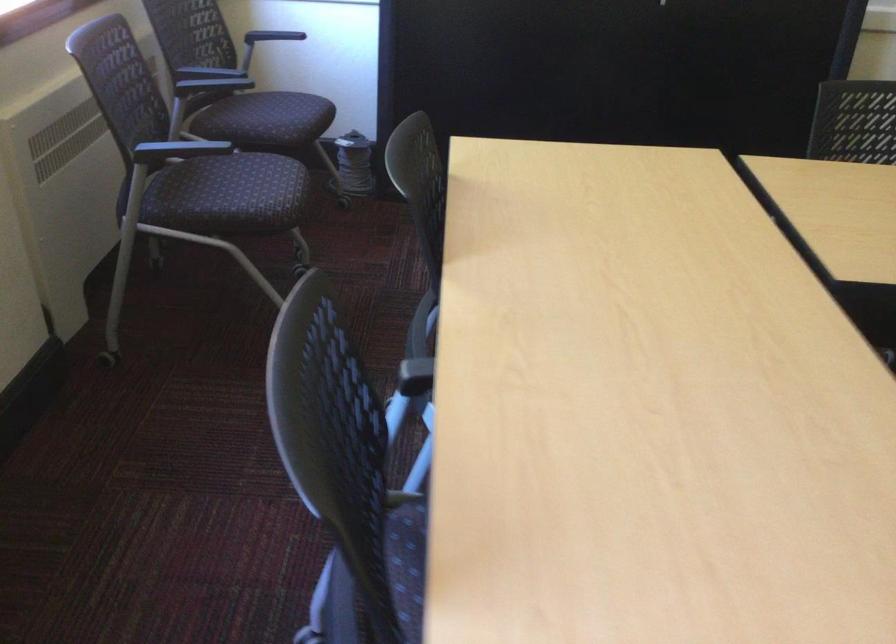
Which object does [355,164] point to?

It refers to a spool of wire.